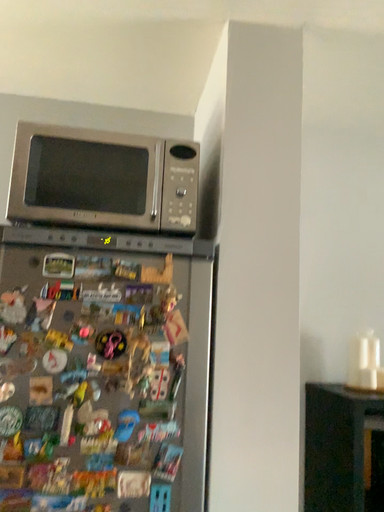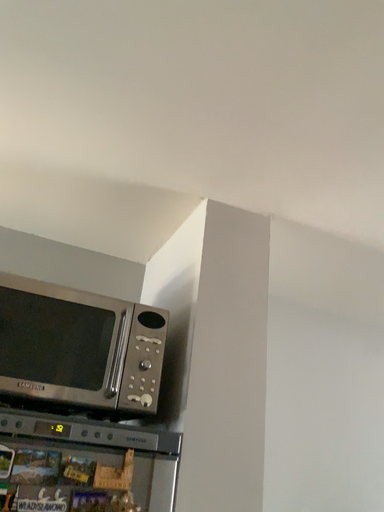
Question: How did the camera likely rotate when shooting the video?

Choices:
 (A) rotated upward
 (B) rotated downward

Answer: (A)